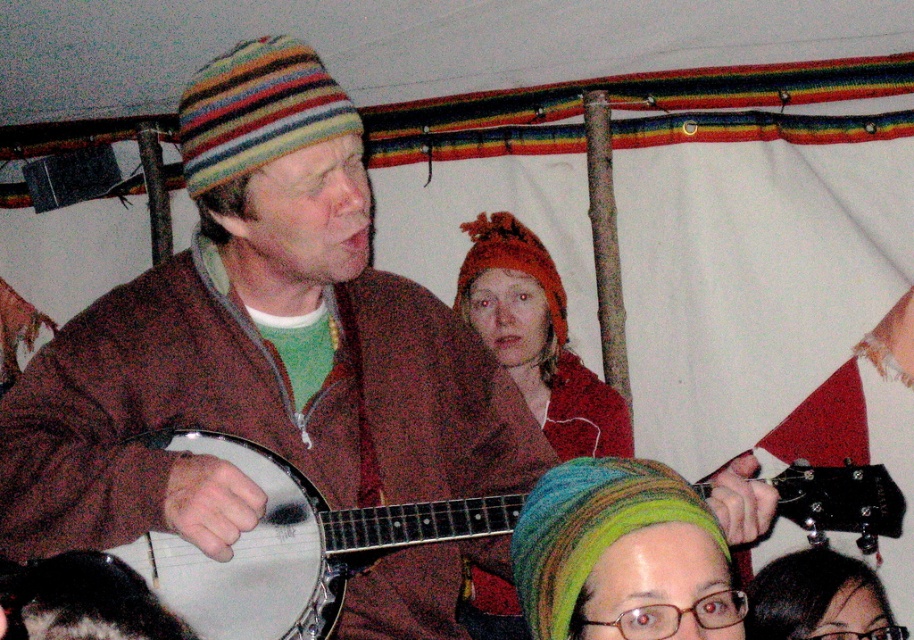
Question: Which point is farther from the camera taking this photo?

Choices:
 (A) (789, 593)
 (B) (391, 627)

Answer: (A)

Question: Can you confirm if white matte banjo at center is wider than knitted red hat at center?

Choices:
 (A) no
 (B) yes

Answer: (B)

Question: Among these points, which one is nearest to the camera?

Choices:
 (A) [x=226, y=468]
 (B) [x=505, y=260]
 (C) [x=284, y=465]
 (D) [x=859, y=625]

Answer: (A)

Question: Is white matte banjo at center further to the viewer compared to knitted red hat at center?

Choices:
 (A) no
 (B) yes

Answer: (A)

Question: Which of the following is the farthest from the observer?

Choices:
 (A) green knitted beanie at lower center
 (B) knitted red hat at center

Answer: (B)

Question: Does white matte banjo at center come in front of knitted red hat at center?

Choices:
 (A) no
 (B) yes

Answer: (B)